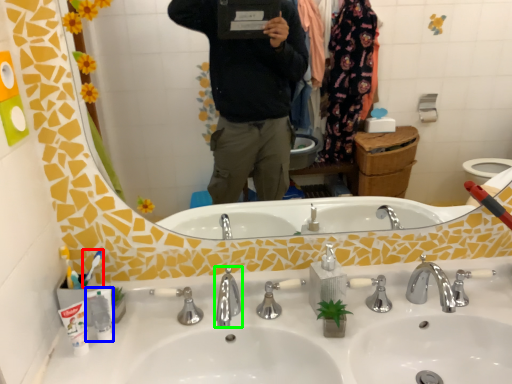
Question: Which object is positioned farthest from toothbrush (highlighted by a red box)? Select from toiletry (highlighted by a blue box) and tap (highlighted by a green box).

Choices:
 (A) toiletry
 (B) tap

Answer: (B)